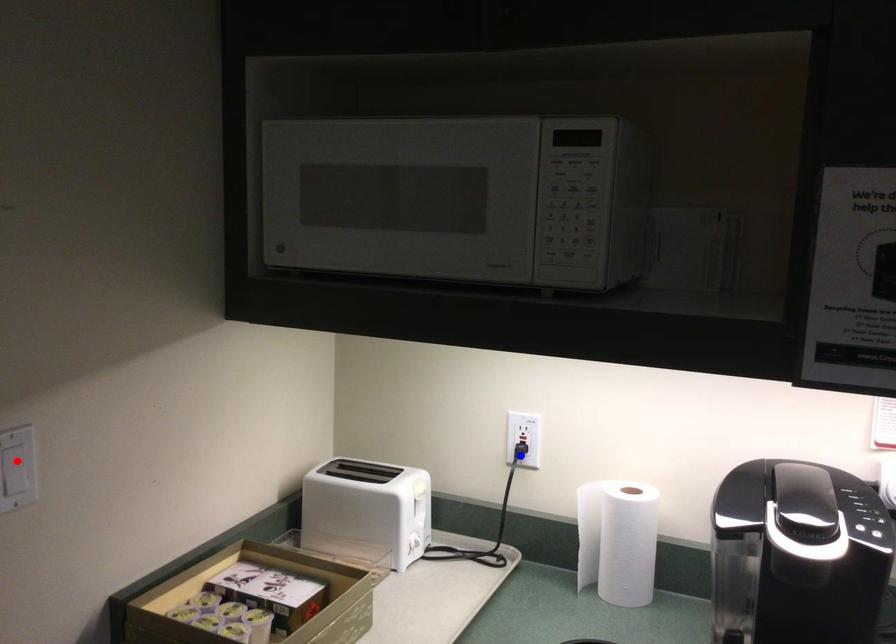
Question: In the image, two points are highlighted. Which point is nearer to the camera? Reply with the corresponding letter.

Choices:
 (A) blue point
 (B) red point

Answer: (B)